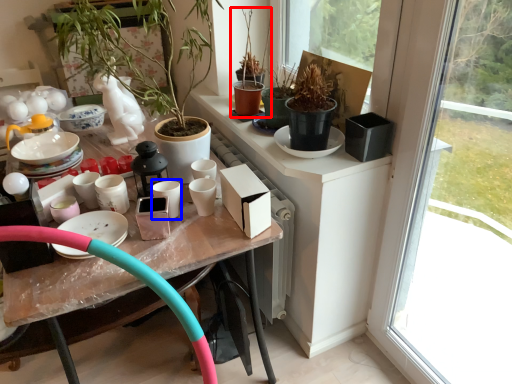
Question: Which point is closer to the camera, houseplant (highlighted by a red box) or tableware (highlighted by a blue box)?

Choices:
 (A) houseplant
 (B) tableware

Answer: (B)